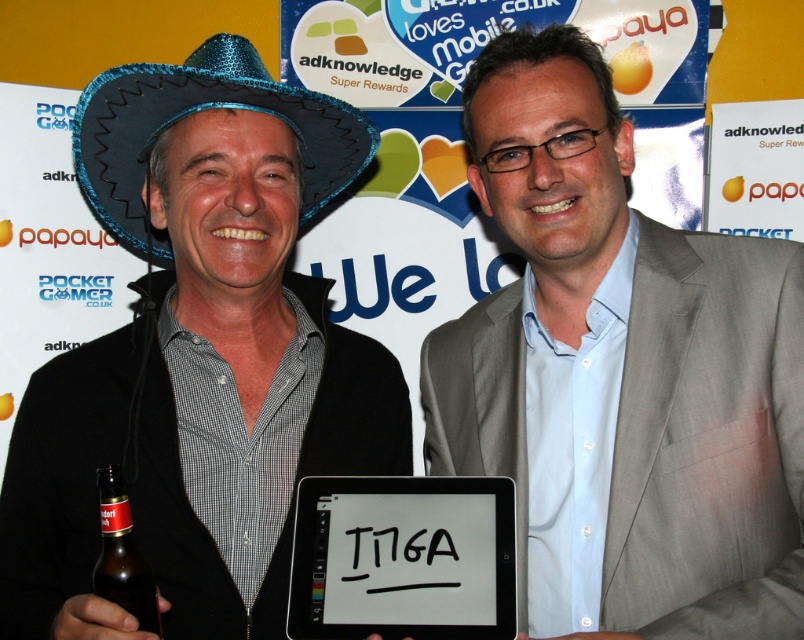
You are a photographer trying to capture the black matte tablet at center and the glittery blue sombrero at left in a single shot. Since the background is cluttered with logos and text, you want to adjust your camera focus to highlight one object. Which object should you focus on to ensure it appears clearer in the photo?

The black matte tablet at center is in front of the glittery blue sombrero at left, so focusing on the black matte tablet at center will make it appear clearer in the photo.

You are a photographer trying to capture a clear shot of the light gray suit at center and the brown glass bottle at lower left. Since you want to focus on the suit, which object should you adjust your camera focus to prioritize, and why?

The light gray suit at center is much taller than the brown glass bottle at lower left, so you should prioritize focusing on the light gray suit at center to ensure it appears sharp and in focus while the bottle may naturally be slightly out of focus due to its smaller size.

Based on the photo, you are a photographer setting up for a group photo. You notice the black matte tablet at center and the glittery blue sombrero at left in the frame. Which object is positioned lower in the image?

The black matte tablet at center is positioned below the glittery blue sombrero at left, so it is lower in the image.